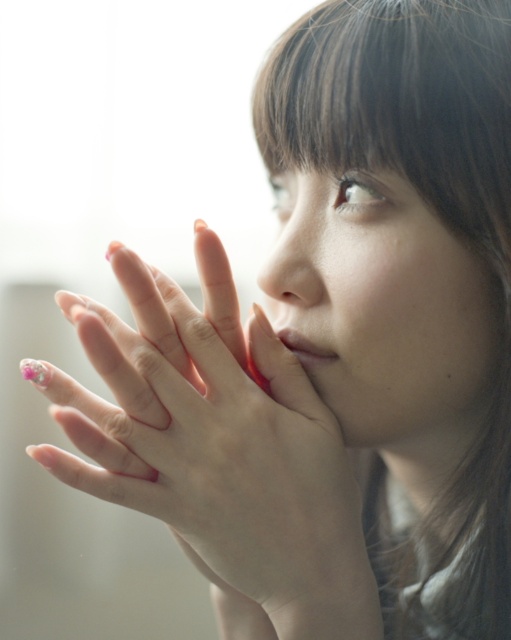
You are a makeup artist preparing for a client consultation. You observe the image and notice the pink nail polish at center and the matte pink lipstick at center. Which product would you recommend using first if you want to avoid smudging the other while working?

The pink nail polish at center is bigger than the matte pink lipstick at center, so you should apply the matte pink lipstick at center first to prevent the larger nail polish from smudging it during application.

You are taking a photo of a person with two points marked on their hands. The points are at coordinates point (474, 388) and point (330, 358). If you want to focus on the point closer to the camera, which coordinate should you choose?

Point (330, 358) is closer to the camera than point (474, 388), so you should focus on point (330, 358).

Looking at the person in the image, where is the pink nail polish at center located in relation to the smooth skin face at center?

The pink nail polish at center is to the left of the smooth skin face at center.